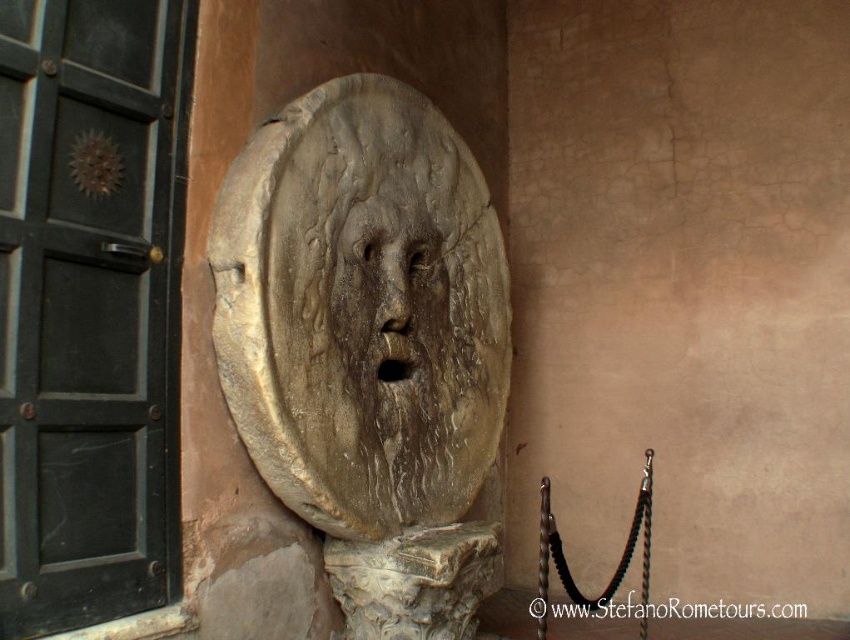
Between brown stone mask at center and rough stone face at center, which one has more height?

brown stone mask at center is taller.

Is point (400, 410) farther from viewer compared to point (374, 394)?

Yes.

This screenshot has width=850, height=640. What are the coordinates of `brown stone mask at center` in the screenshot? It's located at (369, 346).